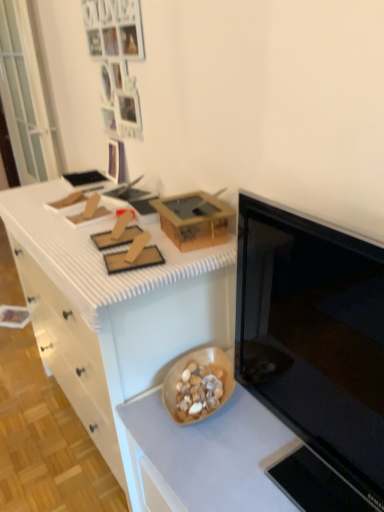
You are a GUI agent. You are given a task and a screenshot of the screen. Output one action in this format:
    pyautogui.click(x=<x>, y=<y>)
    Task: Click on the free space to the left of black glossy microwave at right
    The height and width of the screenshot is (512, 384).
    Given the screenshot: What is the action you would take?
    pyautogui.click(x=220, y=470)